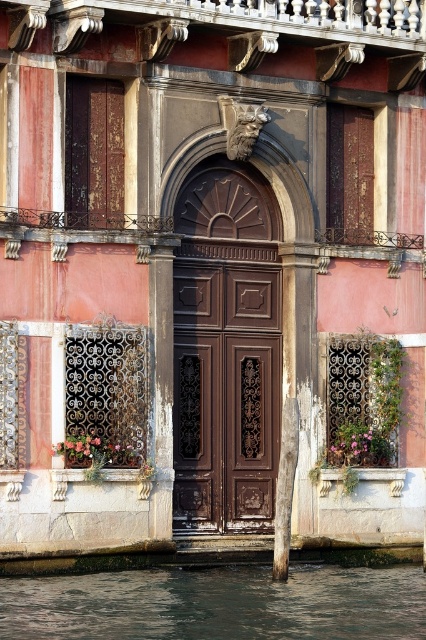
Can you confirm if dark wood paneling at center is positioned to the right of dark green water at lower left?

Incorrect, dark wood paneling at center is not on the right side of dark green water at lower left.

Between point (215, 326) and point (140, 582), which one is positioned behind?

The point (215, 326) is behind.

Where is `dark wood paneling at center`? dark wood paneling at center is located at coordinates (226, 385).